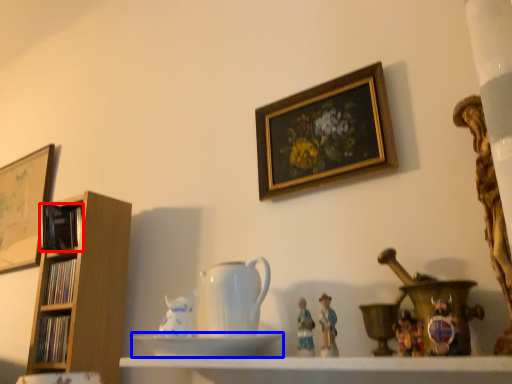
Question: Which object is closer to the camera taking this photo, book (highlighted by a red box) or saucer (highlighted by a blue box)?

Choices:
 (A) book
 (B) saucer

Answer: (B)